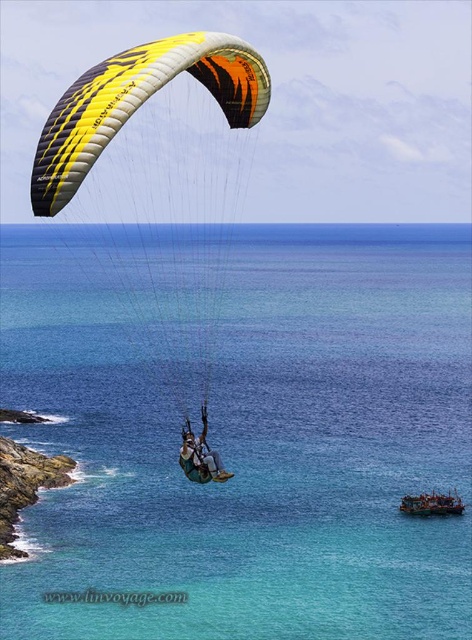
Looking at this image, is yellow/orange fabric parachute at upper center further to the viewer compared to rocky cliff at lower left?

That is False.

Looking at this image, can you confirm if yellow/orange fabric parachute at upper center is shorter than rocky cliff at lower left?

Incorrect, yellow/orange fabric parachute at upper center's height does not fall short of rocky cliff at lower left's.

This screenshot has width=472, height=640. What do you see at coordinates (156, 182) in the screenshot?
I see `yellow/orange fabric parachute at upper center` at bounding box center [156, 182].

Image resolution: width=472 pixels, height=640 pixels. I want to click on yellow/orange fabric parachute at upper center, so click(x=156, y=182).

Between transparent blue water at center and yellow/orange fabric parachute at upper center, which one is positioned higher?

yellow/orange fabric parachute at upper center is higher up.

Can you confirm if transparent blue water at center is positioned to the right of yellow/orange fabric parachute at upper center?

Yes, transparent blue water at center is to the right of yellow/orange fabric parachute at upper center.

Does point (399, 600) lie in front of point (177, 340)?

That is True.

You are a GUI agent. You are given a task and a screenshot of the screen. Output one action in this format:
    pyautogui.click(x=<x>, y=<y>)
    Task: Click on the transparent blue water at center
    
    Given the screenshot: What is the action you would take?
    pyautogui.click(x=250, y=445)

Can you confirm if transparent blue water at center is shorter than rocky cliff at lower left?

In fact, transparent blue water at center may be taller than rocky cliff at lower left.

Measure the distance between transparent blue water at center and camera.

transparent blue water at center and camera are 148.65 meters apart.

Between point (93, 385) and point (62, 468), which one is positioned in front?

Point (62, 468)

Find the location of a particular element. The height and width of the screenshot is (640, 472). transparent blue water at center is located at coordinates (250, 445).